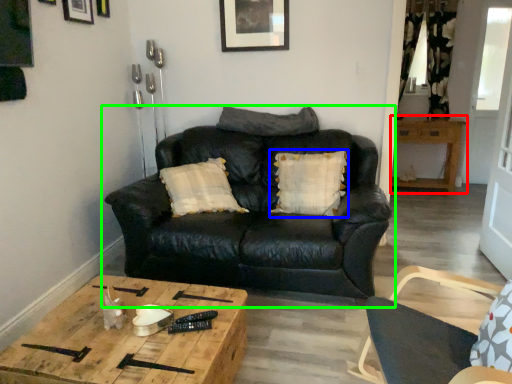
Question: Which object is the farthest from table (highlighted by a red box)? Choose among these: pillow (highlighted by a blue box) or studio couch (highlighted by a green box).

Choices:
 (A) pillow
 (B) studio couch

Answer: (B)